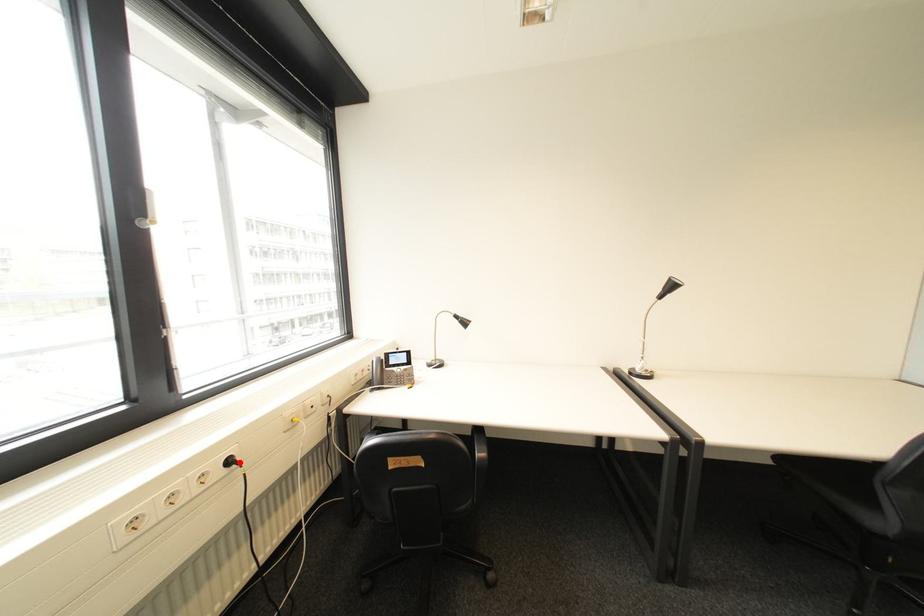
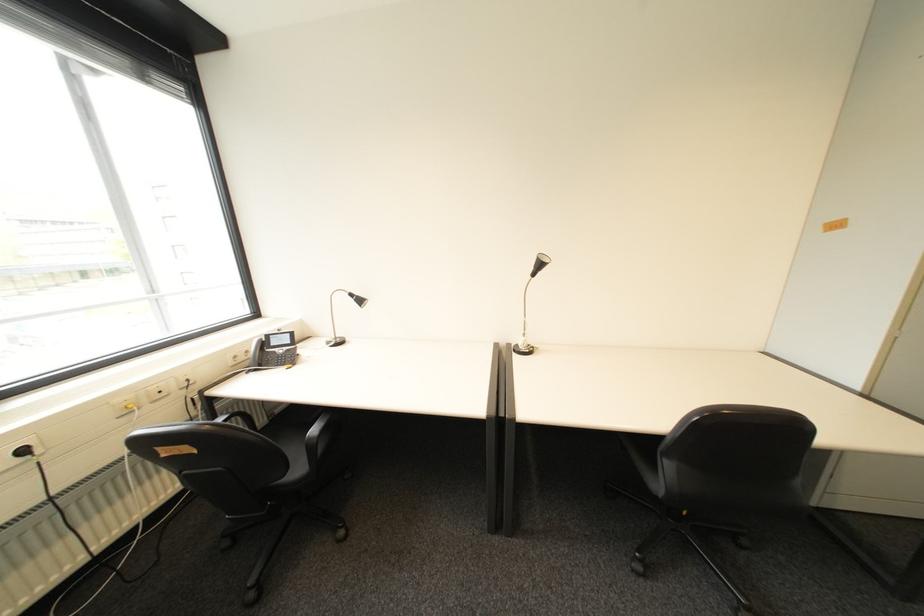
Find the pixel in the second image that matches the highlighted location in the first image.

(34, 452)